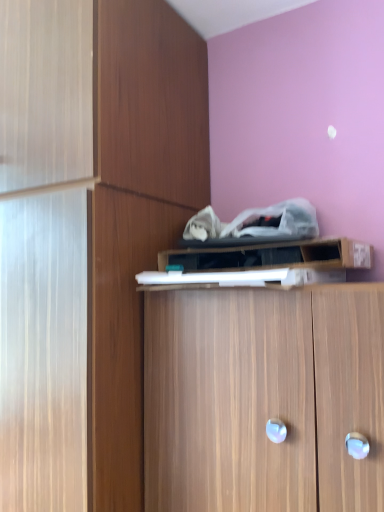
Question: Which direction should I rotate to look at wooden cabinet at center, the 1th cabinetry ordered from the bottom, — up or down?

Choices:
 (A) up
 (B) down

Answer: (B)

Question: Which direction should I rotate to look at wooden cabinet at upper center, which is the third cabinetry in bottom-to-top order?

Choices:
 (A) right
 (B) left

Answer: (A)

Question: Is wooden cabinet at center, which is counted as the 2th cabinetry, starting from the top, aimed at wooden cabinet at upper center, placed as the first cabinetry when sorted from top to bottom?

Choices:
 (A) yes
 (B) no

Answer: (B)

Question: Does wooden cabinet at center, arranged as the 2th cabinetry when ordered from the bottom, have a lesser height compared to wooden cabinet at upper center, placed as the first cabinetry when sorted from top to bottom?

Choices:
 (A) no
 (B) yes

Answer: (A)

Question: Are wooden cabinet at center, arranged as the 2th cabinetry when ordered from the bottom, and wooden cabinet at upper center, placed as the first cabinetry when sorted from top to bottom, located far from each other?

Choices:
 (A) yes
 (B) no

Answer: (B)

Question: From a real-world perspective, is wooden cabinet at center, which is counted as the 2th cabinetry, starting from the top, physically above wooden cabinet at upper center, placed as the first cabinetry when sorted from top to bottom?

Choices:
 (A) no
 (B) yes

Answer: (A)

Question: Is wooden cabinet at upper center, which is the third cabinetry in bottom-to-top order, completely or partially inside wooden cabinet at center, which is counted as the 2th cabinetry, starting from the top?

Choices:
 (A) yes
 (B) no

Answer: (B)

Question: Is wooden cabinet at center, arranged as the 2th cabinetry when ordered from the bottom, completely or partially outside of wooden cabinet at upper center, which is the third cabinetry in bottom-to-top order?

Choices:
 (A) no
 (B) yes

Answer: (B)

Question: Is wooden cabinet at center, the 1th cabinetry ordered from the bottom, smaller than wooden cabinet at center, arranged as the 2th cabinetry when ordered from the bottom?

Choices:
 (A) yes
 (B) no

Answer: (A)

Question: From the image's perspective, would you say wooden cabinet at center, the 1th cabinetry ordered from the bottom, is shown under wooden cabinet at center, arranged as the 2th cabinetry when ordered from the bottom?

Choices:
 (A) yes
 (B) no

Answer: (A)

Question: Is wooden cabinet at center, the 1th cabinetry ordered from the bottom, oriented away from wooden cabinet at center, arranged as the 2th cabinetry when ordered from the bottom?

Choices:
 (A) yes
 (B) no

Answer: (B)

Question: From the image's perspective, does wooden cabinet at center, the 1th cabinetry ordered from the bottom, appear higher than wooden cabinet at center, which is counted as the 2th cabinetry, starting from the top?

Choices:
 (A) no
 (B) yes

Answer: (A)

Question: Considering the relative sizes of wooden cabinet at center, the 3th cabinetry in the top-to-bottom sequence, and wooden cabinet at center, which is counted as the 2th cabinetry, starting from the top, in the image provided, is wooden cabinet at center, the 3th cabinetry in the top-to-bottom sequence, wider than wooden cabinet at center, which is counted as the 2th cabinetry, starting from the top,?

Choices:
 (A) no
 (B) yes

Answer: (A)

Question: From a real-world perspective, is wooden cabinet at center, the 1th cabinetry ordered from the bottom, over wooden cabinet at center, arranged as the 2th cabinetry when ordered from the bottom?

Choices:
 (A) yes
 (B) no

Answer: (B)

Question: Is wooden cabinet at center, arranged as the 2th cabinetry when ordered from the bottom, aimed at wooden cabinet at center, the 1th cabinetry ordered from the bottom?

Choices:
 (A) yes
 (B) no

Answer: (B)